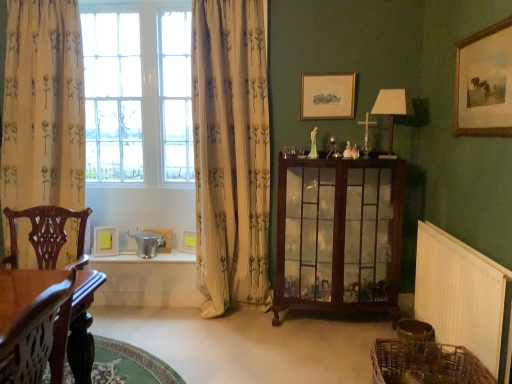
Identify the location of vacant region under white floral fabric curtain at left, positioned as the 2th curtain in left-to-right order (from a real-world perspective). This screenshot has height=384, width=512. (233, 317).